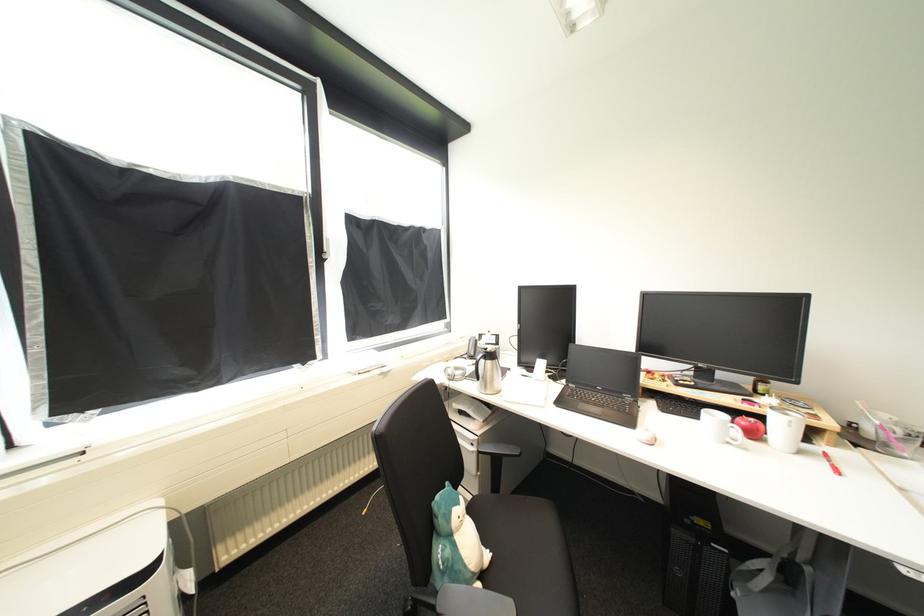
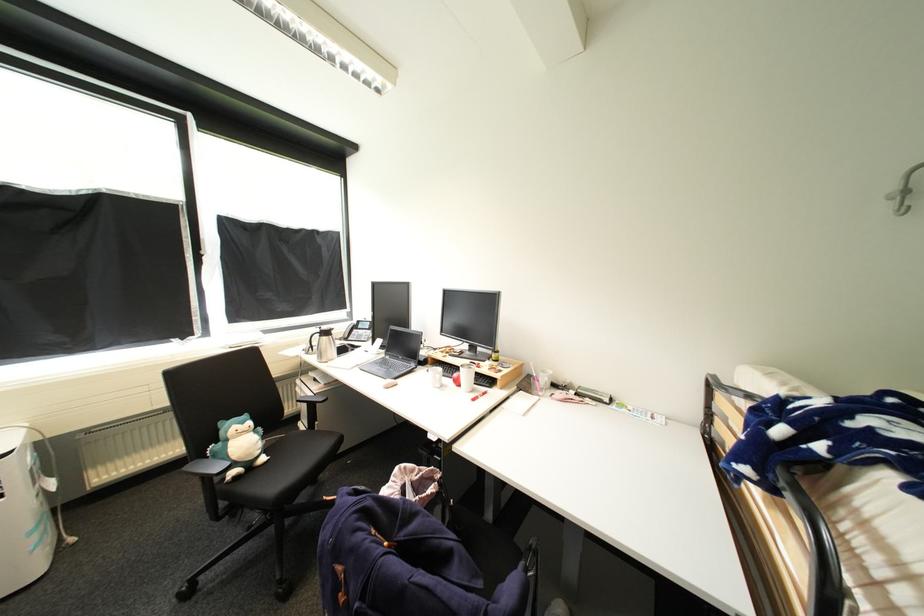
In a continuous first-person perspective shot, in which direction is the camera moving?

The cameraman moved toward right, backward.